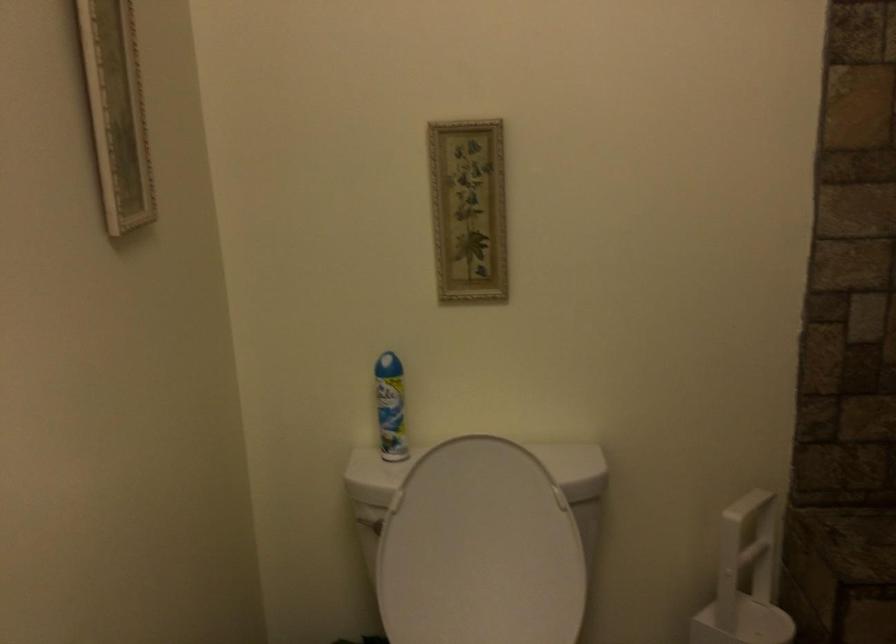
The image size is (896, 644). What do you see at coordinates (479, 550) in the screenshot? I see `the white toilet lid` at bounding box center [479, 550].